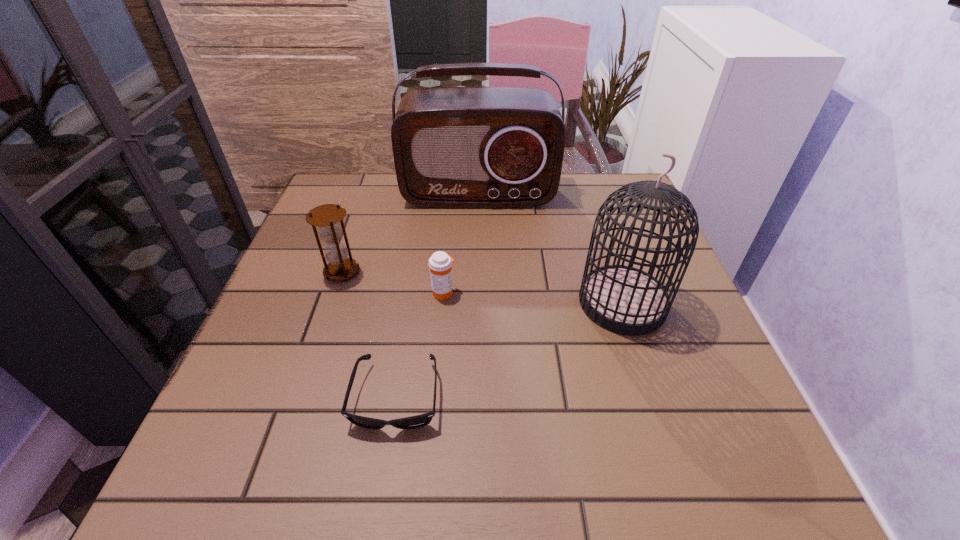
Find the location of a particular element. vacant region located 0.380m on the back of the medicine is located at coordinates (452, 188).

Where is `object that is positioned at the far edge`? The height and width of the screenshot is (540, 960). object that is positioned at the far edge is located at coordinates (454, 147).

Where is `object at the left edge`? The width and height of the screenshot is (960, 540). object at the left edge is located at coordinates (326, 217).

Locate an element on the screen. This screenshot has width=960, height=540. object that is at the right edge is located at coordinates (625, 300).

At what (x,y) coordinates should I click in order to perform the action: click on vacant space at the far edge of the desktop. Please return your answer as a coordinate pair (x, y). The width and height of the screenshot is (960, 540). Looking at the image, I should click on (471, 215).

You are a GUI agent. You are given a task and a screenshot of the screen. Output one action in this format:
    pyautogui.click(x=<x>, y=<y>)
    Task: Click on the free space at the near edge
    This screenshot has width=960, height=540.
    Given the screenshot: What is the action you would take?
    pyautogui.click(x=438, y=462)

In the image, there is a desktop. Where is `free space at the left edge`? free space at the left edge is located at coordinates (298, 383).

The height and width of the screenshot is (540, 960). In the image, there is a desktop. In order to click on vacant space at the right edge in this screenshot , I will do `click(643, 270)`.

This screenshot has width=960, height=540. Find the location of `vacant region at the far left corner of the desktop`. vacant region at the far left corner of the desktop is located at coordinates (338, 183).

In the image, there is a desktop. Find the location of `vacant area at the near left corner`. vacant area at the near left corner is located at coordinates (268, 484).